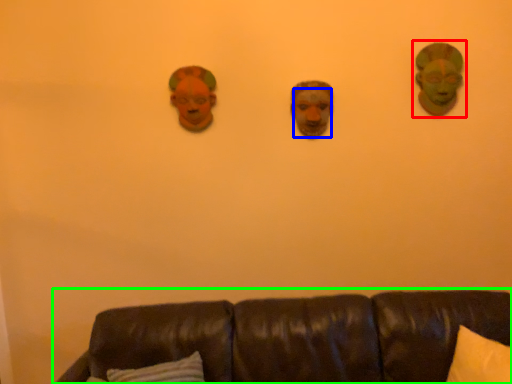
Question: Estimate the real-world distances between objects in this image. Which object is farther from person (highlighted by a red box), human face (highlighted by a blue box) or studio couch (highlighted by a green box)?

Choices:
 (A) human face
 (B) studio couch

Answer: (B)